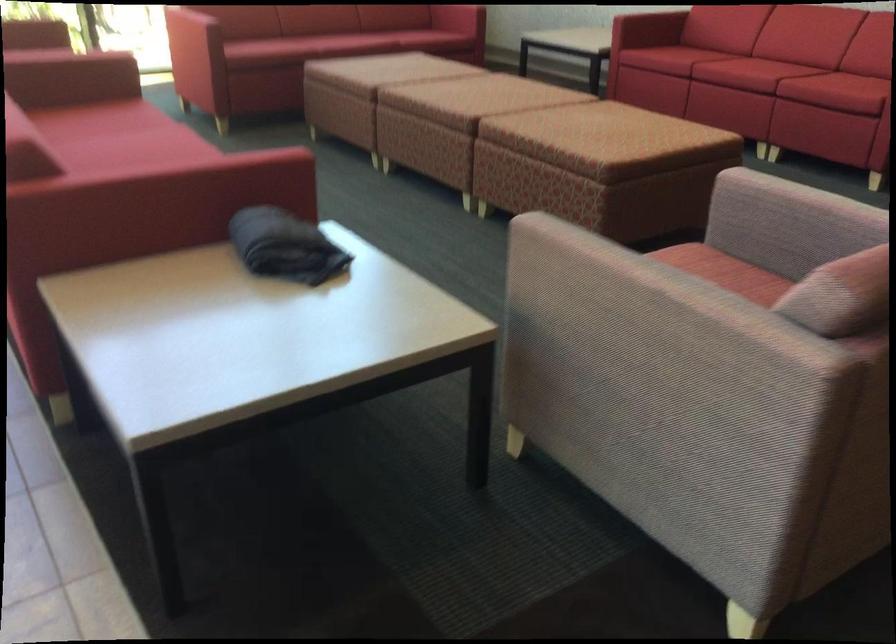
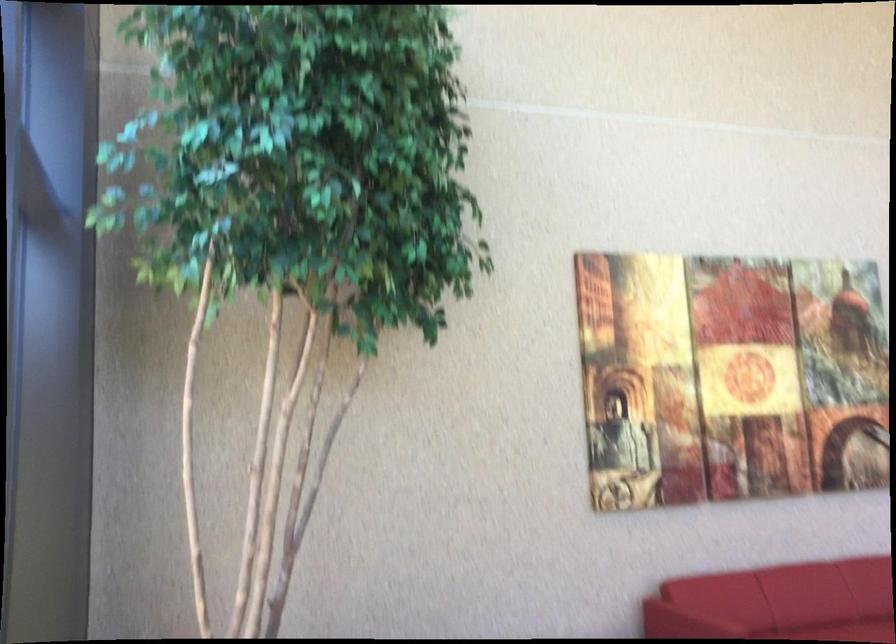
Question: The images are taken continuously from a first-person perspective. In which direction are you moving?

Choices:
 (A) Left
 (B) Right
 (C) Forward
 (D) Backward

Answer: (D)